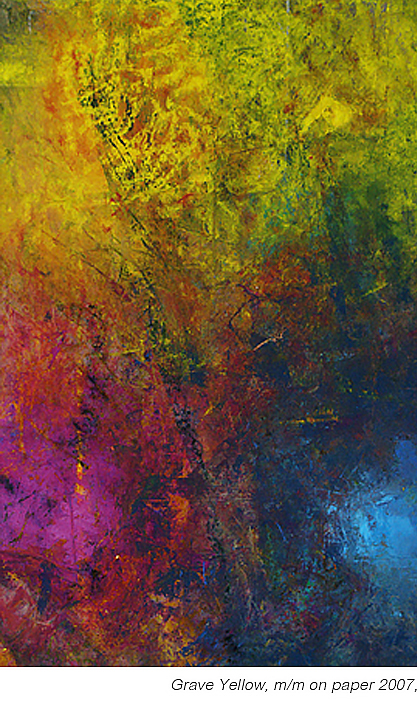
Where is `yellow part of painting`? yellow part of painting is located at coordinates (214, 88).